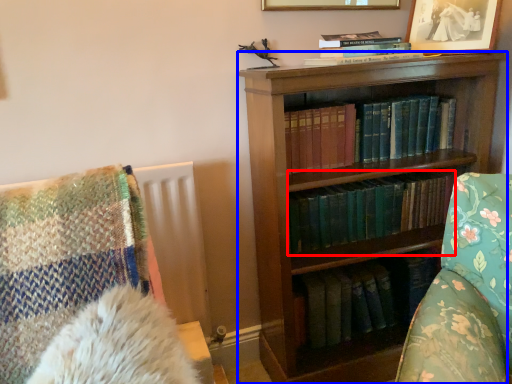
Question: Which object is further to the camera taking this photo, book (highlighted by a red box) or bookcase (highlighted by a blue box)?

Choices:
 (A) book
 (B) bookcase

Answer: (A)